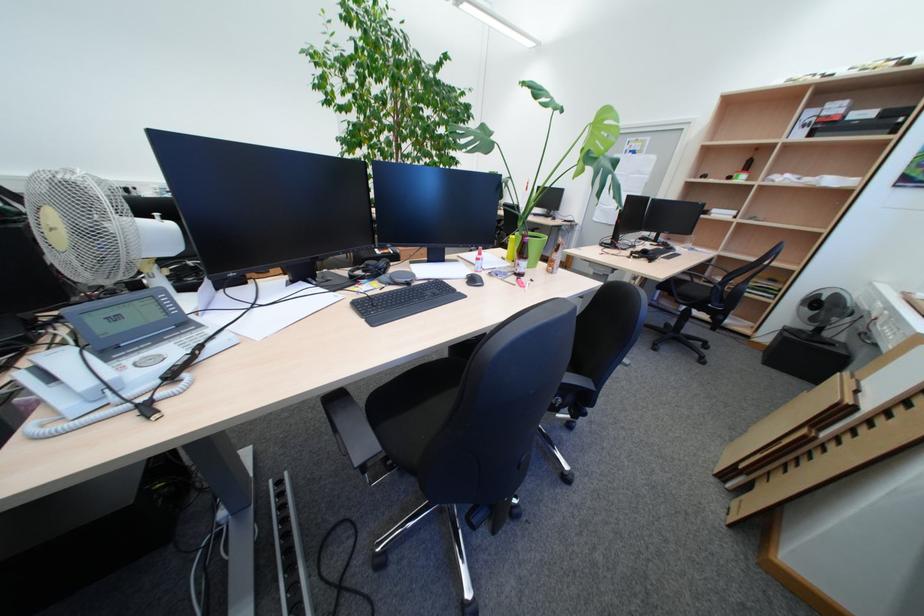
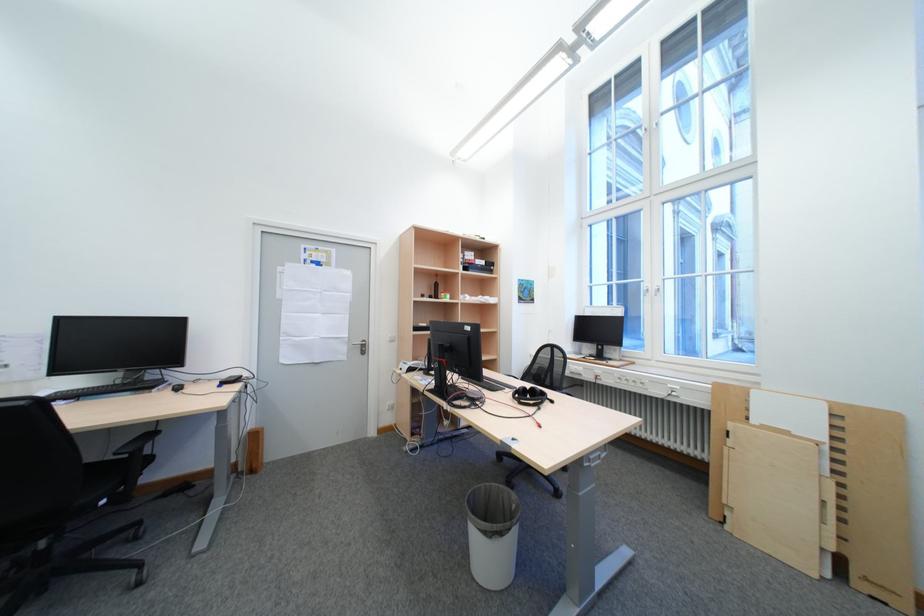
Find the pixel in the second image that matches pixel 823 134 in the first image.

(477, 270)